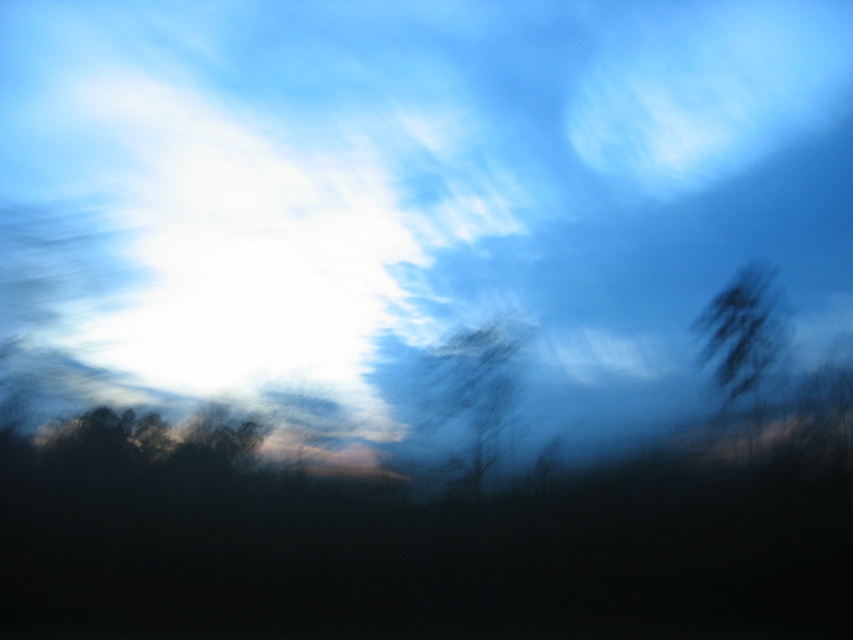
You are an airplane pilot flying at an altitude where you can see both the white fluffy cloud at upper center and the dark brown textured tree at center. Which object appears wider from your perspective?

The white fluffy cloud at upper center appears wider than the dark brown textured tree at center because its width is larger according to the description.

You are a photographer trying to capture the white fluffy cloud at upper center in your shot. Based on its position, where should you aim your camera relative to the sun?

The white fluffy cloud at upper center is located at point coordinates, so you should aim your camera towards the upper center area where the cloud is positioned, which is near the sun in the upper left portion of the frame.

You are an astronomer observing the sky. You notice the white fluffy cloud at upper center and the dark brown textured tree at center. Which object appears bigger in the sky?

The white fluffy cloud at upper center appears bigger than the dark brown textured tree at center because it has a larger size compared to it.